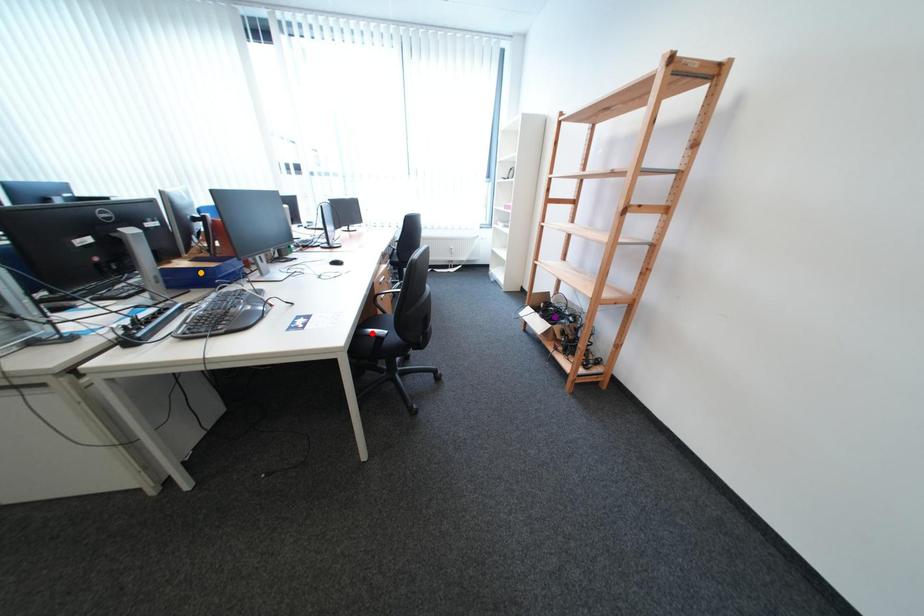
Consider the image. Order these from nearest to farthest:
purple point | red point | orange point

1. purple point
2. orange point
3. red point